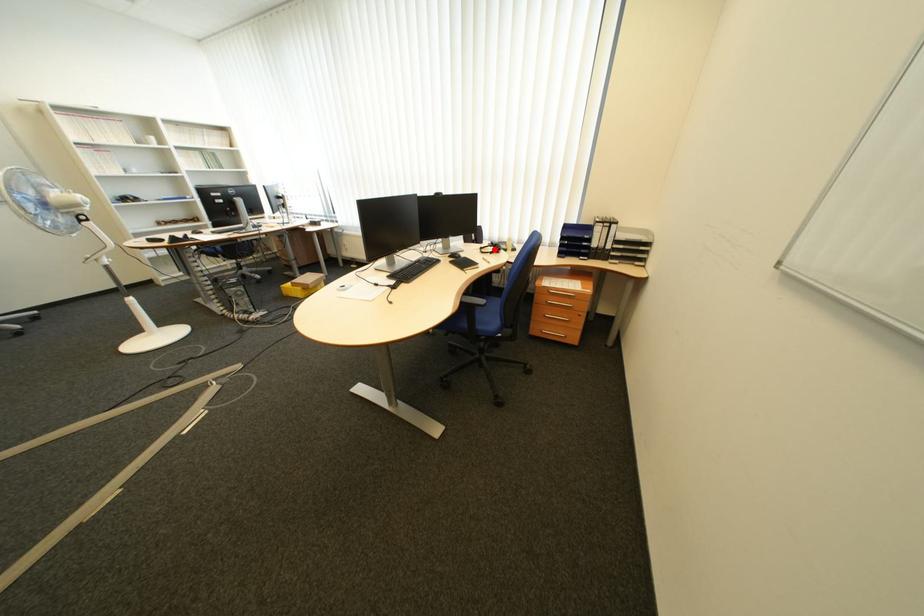
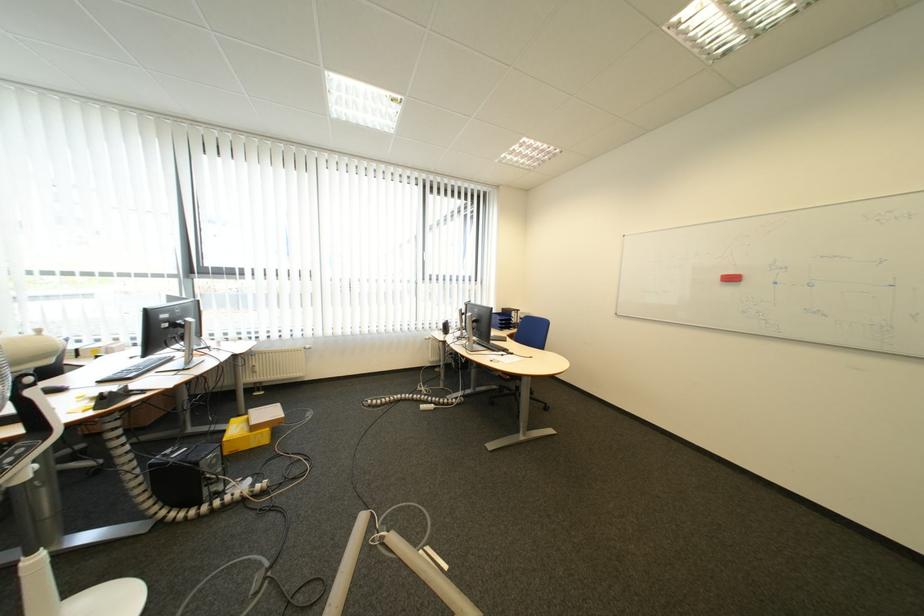
Question: I am providing you with two images of the same scene from different viewpoints. A red point is marked on the first image. Can you still see the location of the red point in image 2?

Choices:
 (A) Yes
 (B) No

Answer: (B)